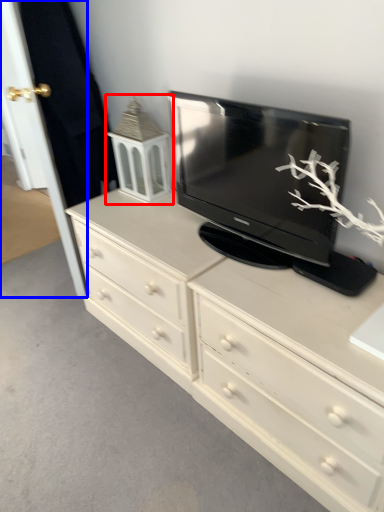
Question: Which point is further to the camera, tv cabinet (highlighted by a red box) or door (highlighted by a blue box)?

Choices:
 (A) tv cabinet
 (B) door

Answer: (A)